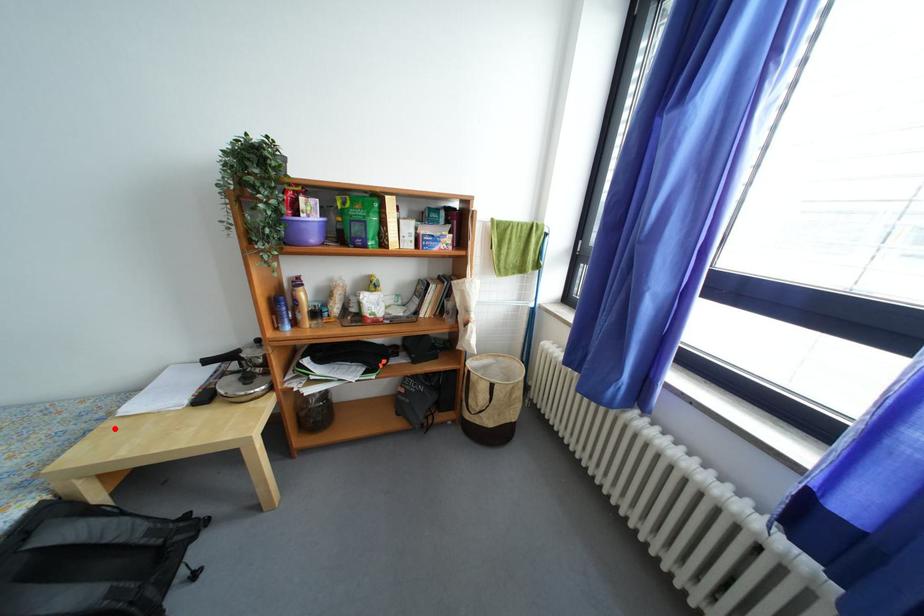
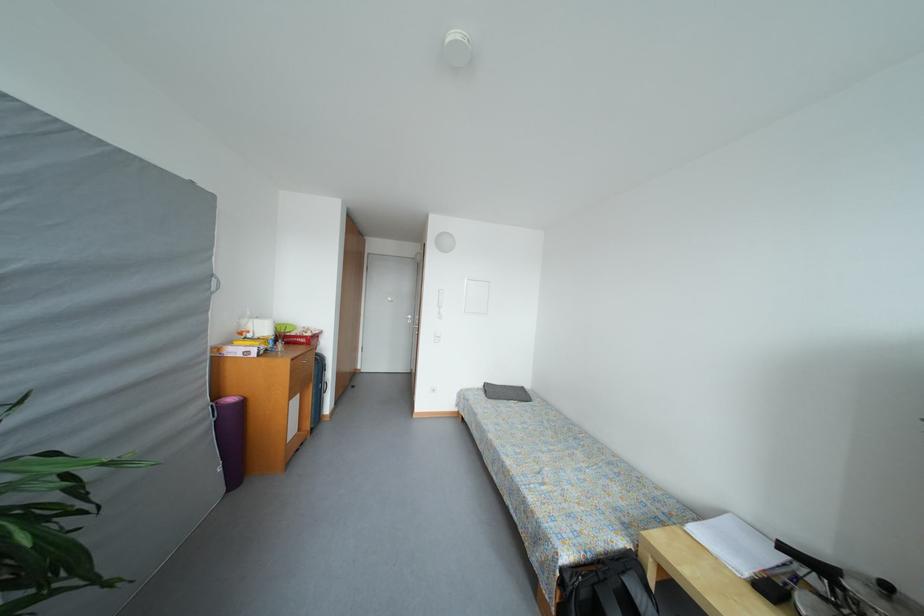
Where in the second image is the point corresponding to the highlighted location from the first image?

(684, 533)